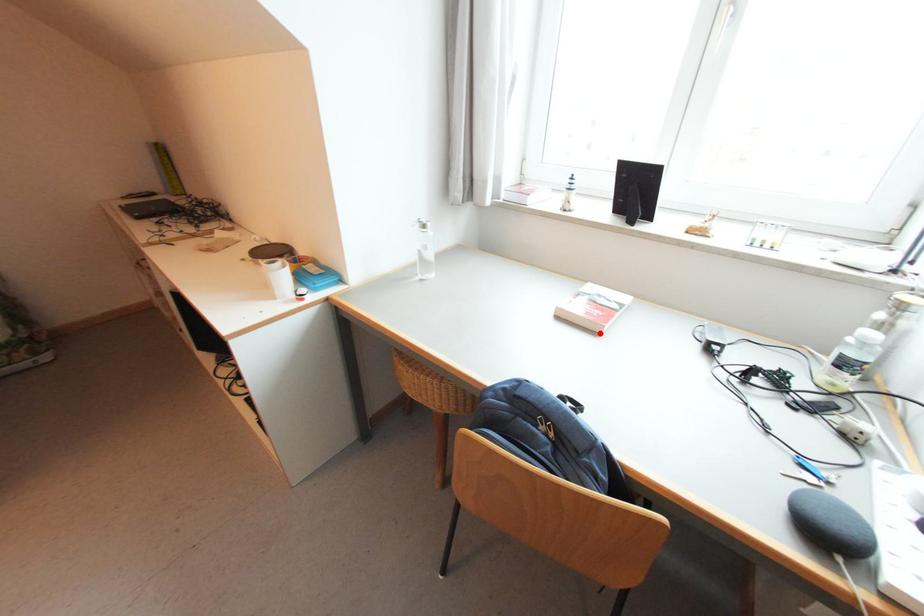
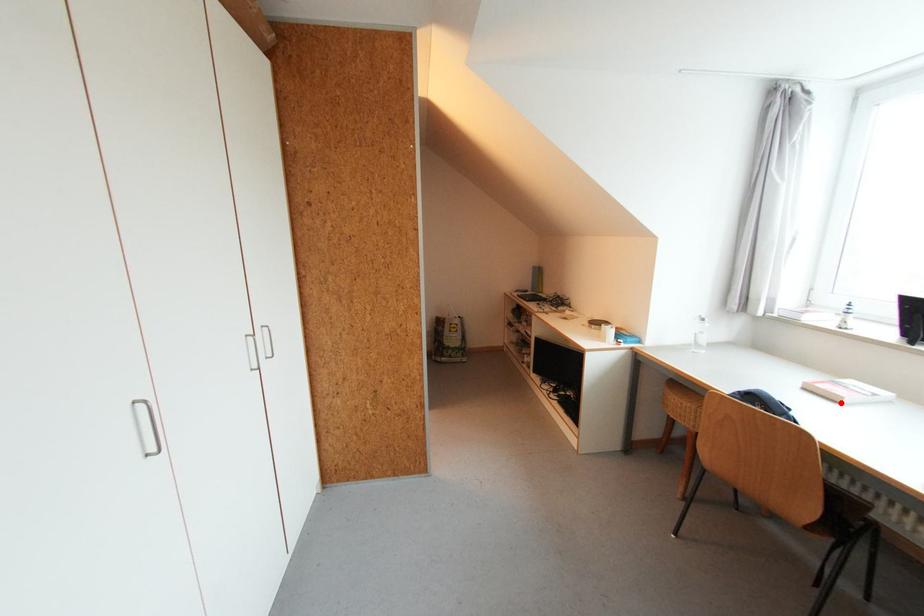
I am providing you with two images of the same scene from different viewpoints. A red point is marked on the first image and another point is marked on the second image. Does the point marked in image1 correspond to the same location as the one in image2?

Yes